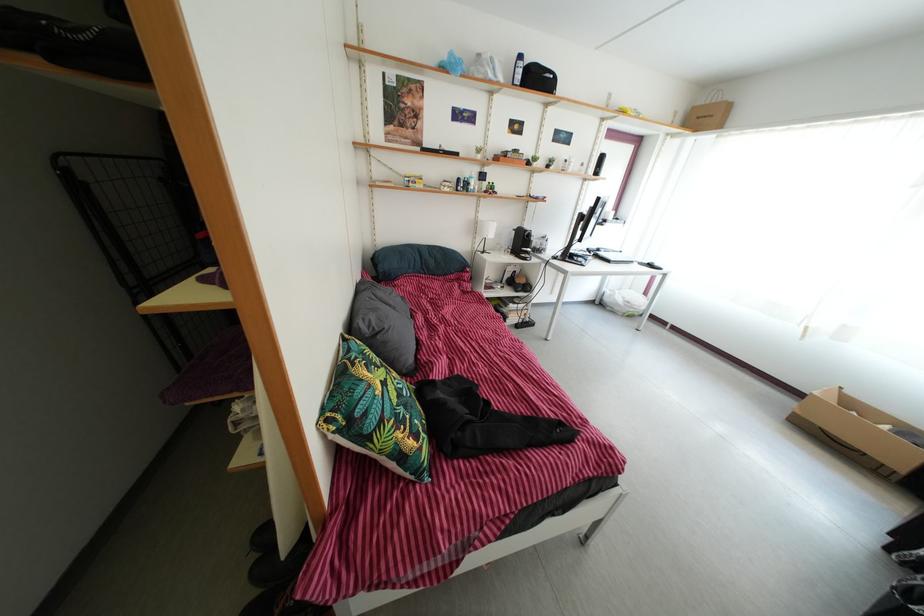
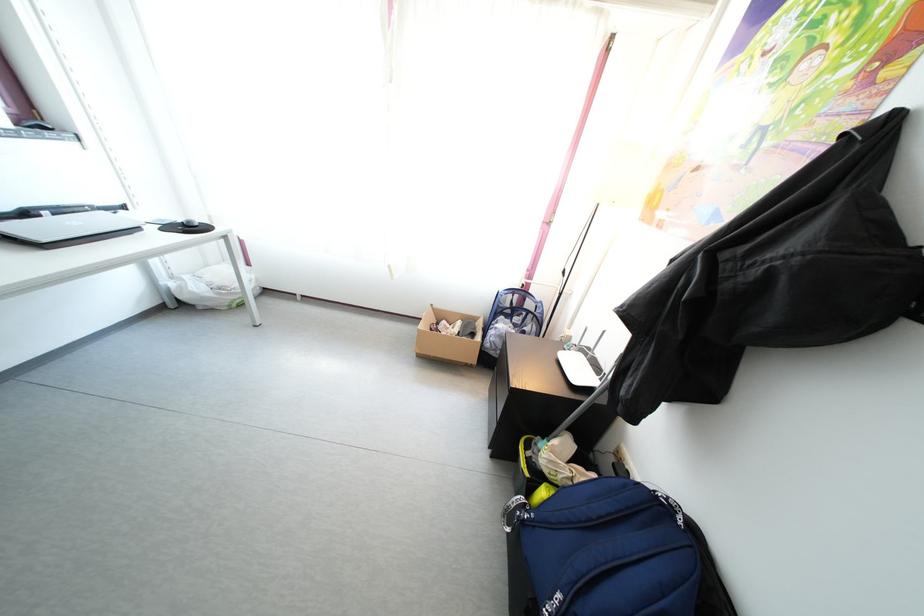
Find the pixel in the second image that matches point (604, 257) in the first image.

(31, 222)